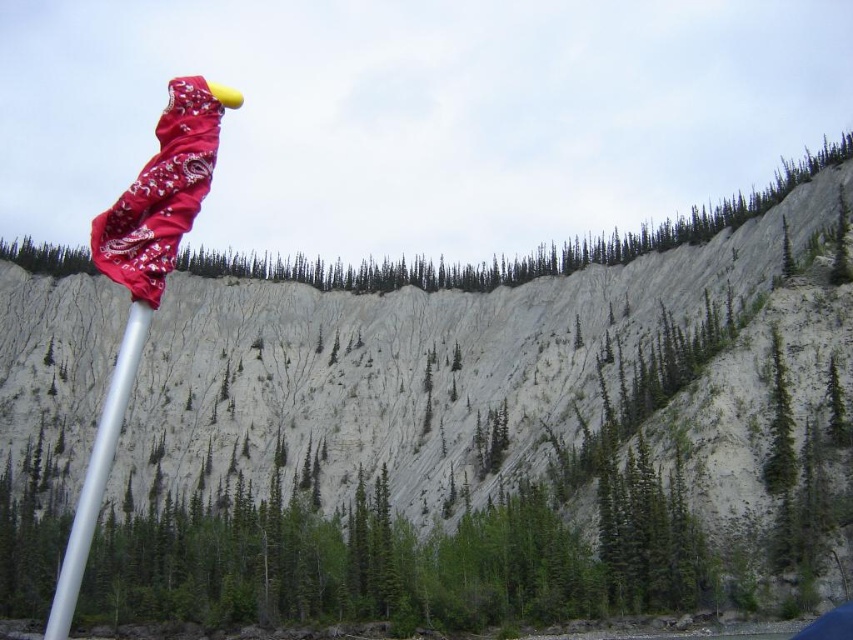
Question: Which of the following is the farthest from the observer?

Choices:
 (A) (782, 454)
 (B) (107, 445)

Answer: (A)

Question: Can you confirm if silver metallic pole at left is bigger than green textured tree at center?

Choices:
 (A) yes
 (B) no

Answer: (A)

Question: Is silver metallic pole at left to the right of green textured tree at center from the viewer's perspective?

Choices:
 (A) yes
 (B) no

Answer: (B)

Question: Among these objects, which one is nearest to the camera?

Choices:
 (A) silver metallic pole at left
 (B) green textured tree at center

Answer: (A)

Question: Is silver metallic pole at left above green textured tree at center?

Choices:
 (A) no
 (B) yes

Answer: (A)